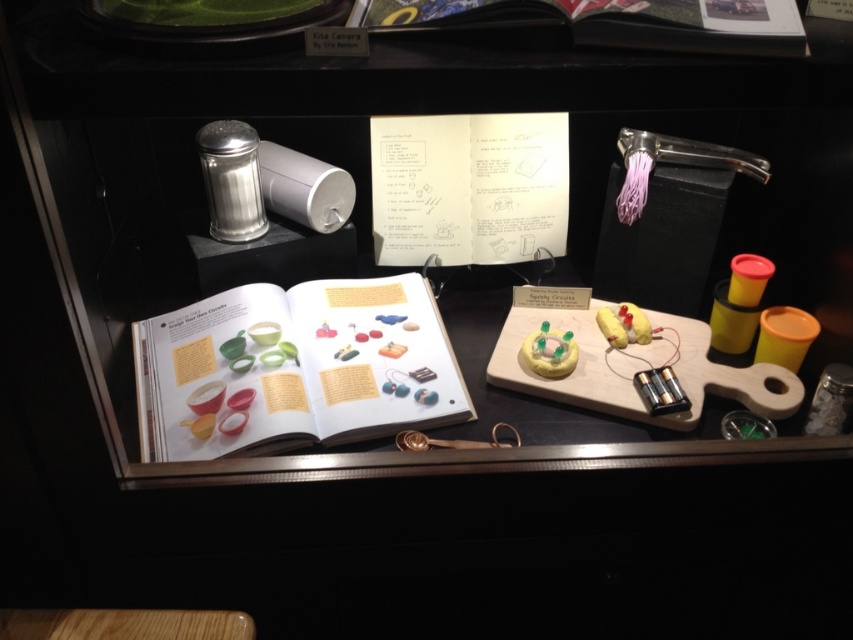
You are looking at the display case and notice two points marked in the image. Which point is closer to you, point (790, 8) or point (231, 163)?

Point (790, 8) is closer to the viewer than point (231, 163).

Based on the photo, you are standing in front of the display case and want to touch both points labeled as point (219, 378) and point (442, 20). Which point should you reach for first to touch the one closer to you?

Point (219, 378) is closer to you, so you should reach for it first.